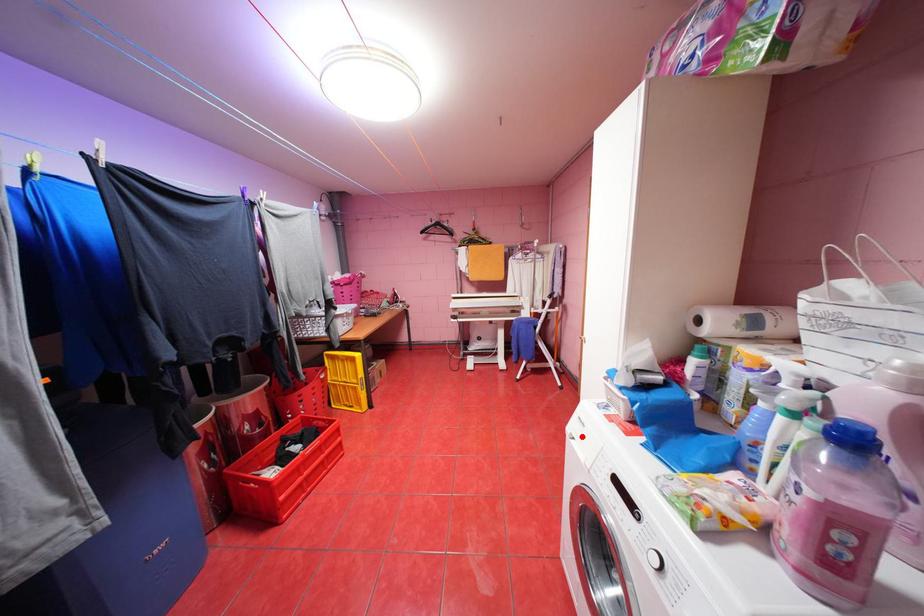
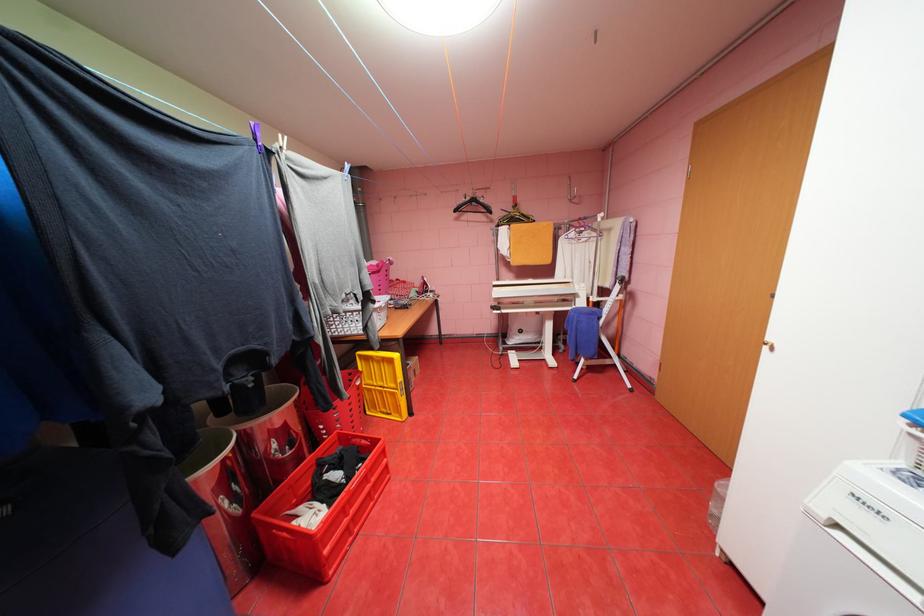
In the second image, find the point that corresponds to the highlighted location in the first image.

(845, 525)